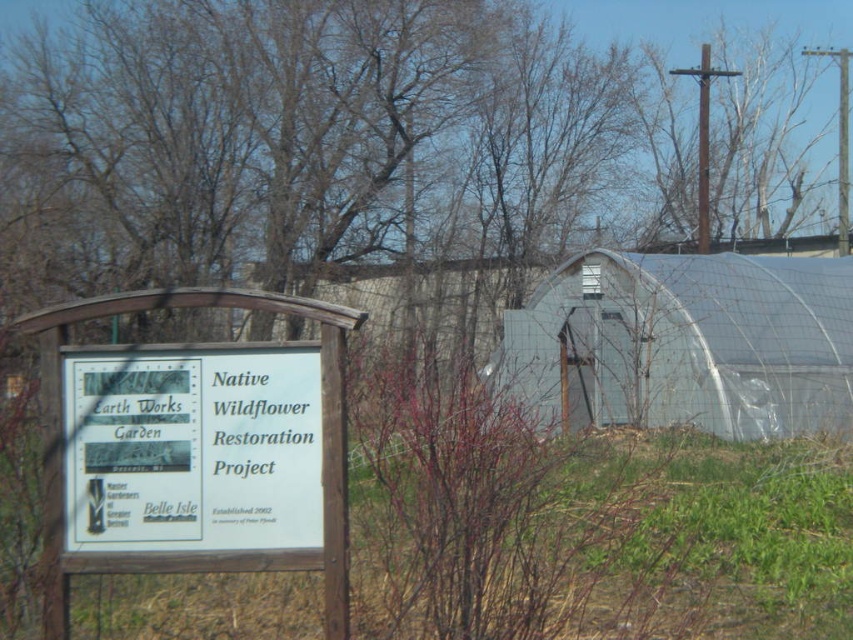
Question: Where is bare branches at center located in relation to white wood sign at center in the image?

Choices:
 (A) right
 (B) left

Answer: (A)

Question: Can you confirm if bare branches at center is positioned below white wood sign at center?

Choices:
 (A) no
 (B) yes

Answer: (B)

Question: Among these points, which one is farthest from the camera?

Choices:
 (A) (247, 492)
 (B) (428, 502)

Answer: (B)

Question: Can you confirm if bare branches at center is smaller than white wood sign at center?

Choices:
 (A) yes
 (B) no

Answer: (B)

Question: Which object appears closest to the camera in this image?

Choices:
 (A) bare branches at center
 (B) white wood sign at center

Answer: (B)